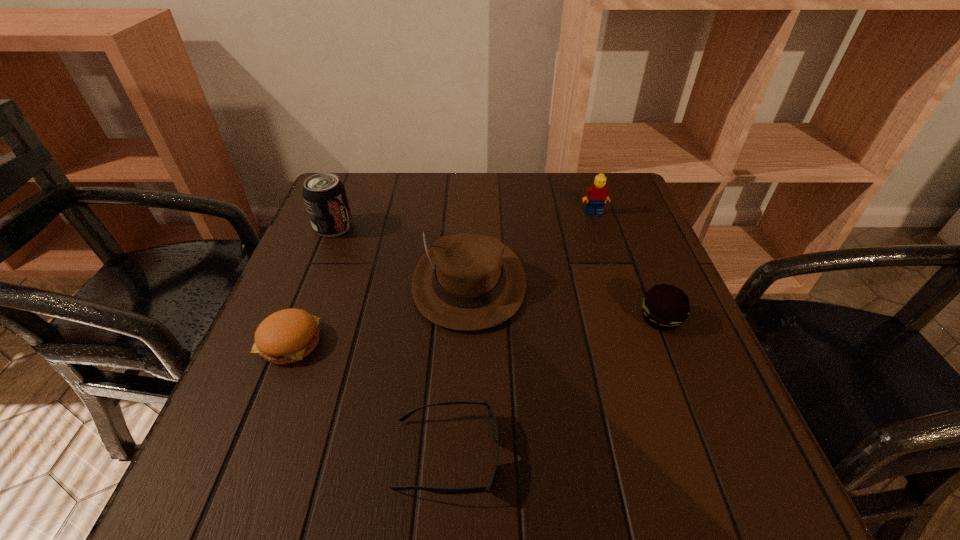
Locate an element on the screen. The height and width of the screenshot is (540, 960). vacant area that lies between the soda can and the fourth shortest object is located at coordinates (464, 220).

Where is `the closest object to the Lego`? the closest object to the Lego is located at coordinates (467, 282).

Select which object appears as the second closest to the taller patty. Please provide its 2D coordinates. Your answer should be formatted as a tuple, i.e. [(x, y)], where the tuple contains the x and y coordinates of a point satisfying the conditions above.

[(598, 193)]

This screenshot has width=960, height=540. What are the coordinates of `vacant space that satisfies the following two spatial constraints: 1. on the feather side of the fedora; 2. on the right side of the fourth tallest object` in the screenshot? It's located at (468, 319).

Where is `vacant space that satisfies the following two spatial constraints: 1. on the front-facing side of the taller patty; 2. on the right side of the Lego`? vacant space that satisfies the following two spatial constraints: 1. on the front-facing side of the taller patty; 2. on the right side of the Lego is located at coordinates (629, 319).